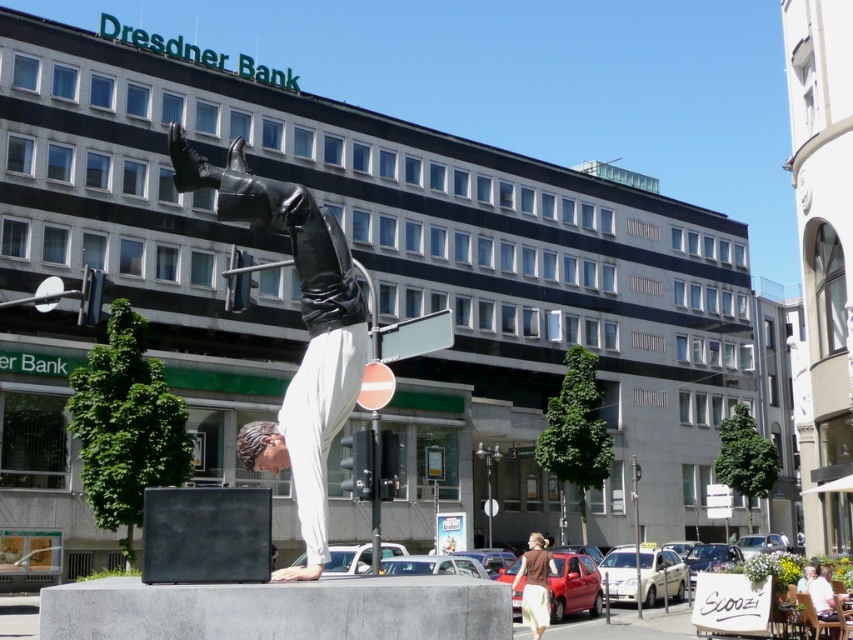
Question: Considering the relative positions of polished bronze statue at center and brown cotton shirt at lower center in the image provided, where is polished bronze statue at center located with respect to brown cotton shirt at lower center?

Choices:
 (A) above
 (B) below

Answer: (A)

Question: Which point appears closest to the camera in this image?

Choices:
 (A) (288, 436)
 (B) (527, 577)

Answer: (A)

Question: Which point is closer to the camera?

Choices:
 (A) polished bronze statue at center
 (B) brown cotton shirt at lower center

Answer: (A)

Question: Does polished bronze statue at center lie behind brown cotton shirt at lower center?

Choices:
 (A) no
 (B) yes

Answer: (A)

Question: Is polished bronze statue at center positioned behind brown cotton shirt at lower center?

Choices:
 (A) no
 (B) yes

Answer: (A)